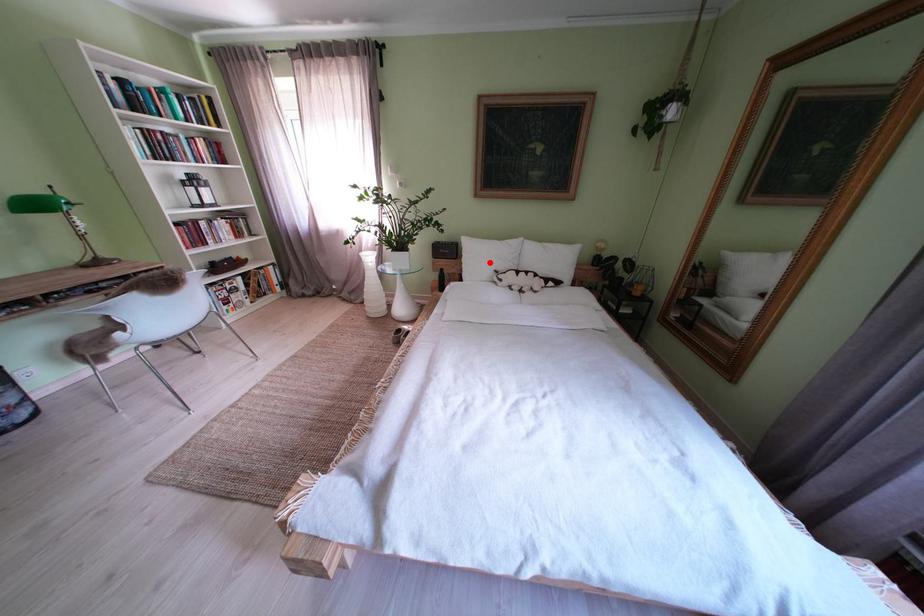
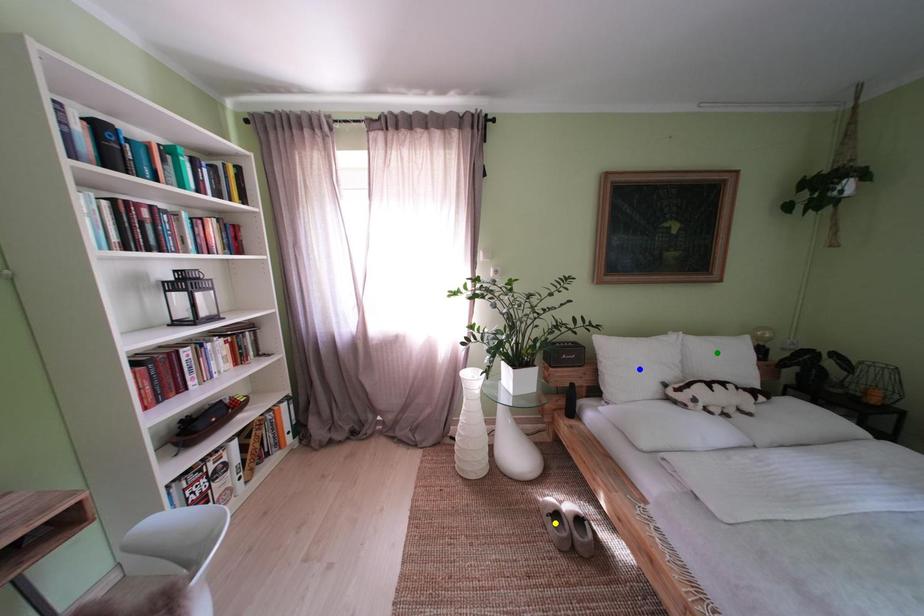
Question: I am providing you with two images of the same scene from different viewpoints. A red point is marked on the first image. You are given multiple points on the second image. Which point in image 2 represents the same 3d spot as the red point in image 1?

Choices:
 (A) green point
 (B) blue point
 (C) yellow point

Answer: (B)